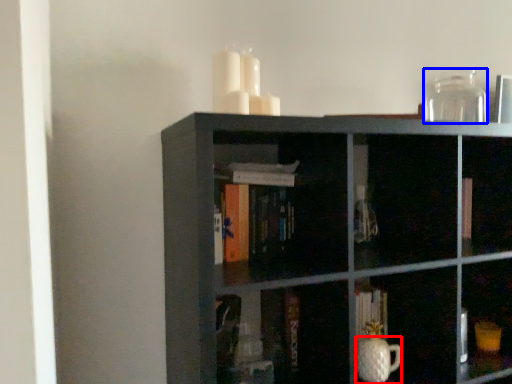
Question: Which object appears closest to the camera in this image, glass vase (highlighted by a red box) or glass vase (highlighted by a blue box)?

Choices:
 (A) glass vase
 (B) glass vase

Answer: (A)